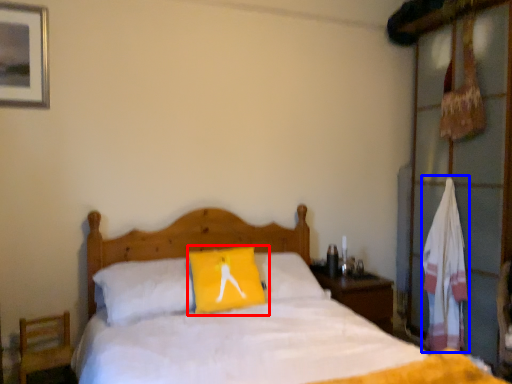
Question: Which object appears closest to the camera in this image, pillow (highlighted by a red box) or material (highlighted by a blue box)?

Choices:
 (A) pillow
 (B) material

Answer: (A)